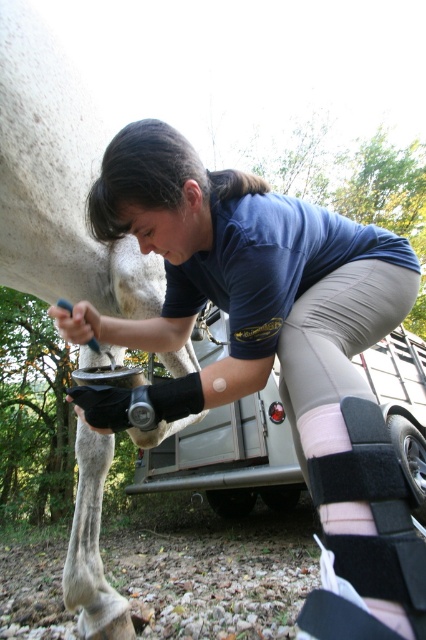
You are a farrier working on a horse and need to reach the black matte knee brace at lower center. Based on its position, where should you look to find it?

The black matte knee brace at lower center is located at point (262, 317), so you should look towards the lower center area to find it.

You are a farrier working on a horse. You need to check if the black matte knee brace at lower center can be seen from the same angle as the white matte horse leg at upper left. Based on their heights, will the knee brace be visible?

The black matte knee brace at lower center has a lesser height compared to the white matte horse leg at upper left. Since the knee brace is shorter, it might be obscured by the horse leg if they are aligned in the same line of sight. However, visibility depends on their exact positions and angles, but based on height alone, the knee brace could be partially visible unless the horse leg blocks it completely.